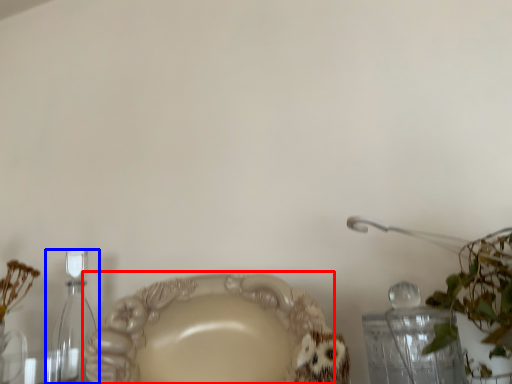
Question: Among these objects, which one is nearest to the camera, plate (highlighted by a red box) or bottle (highlighted by a blue box)?

Choices:
 (A) plate
 (B) bottle

Answer: (A)